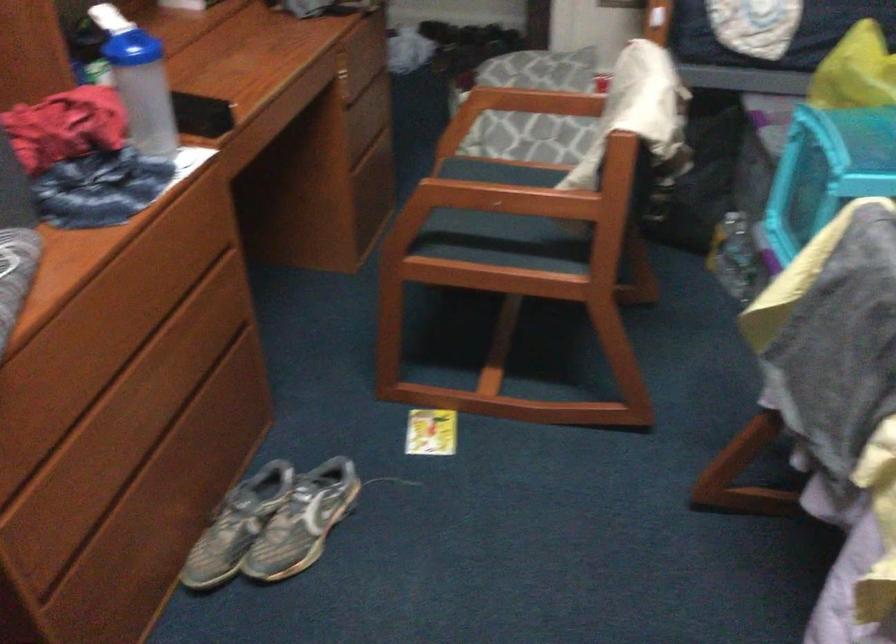
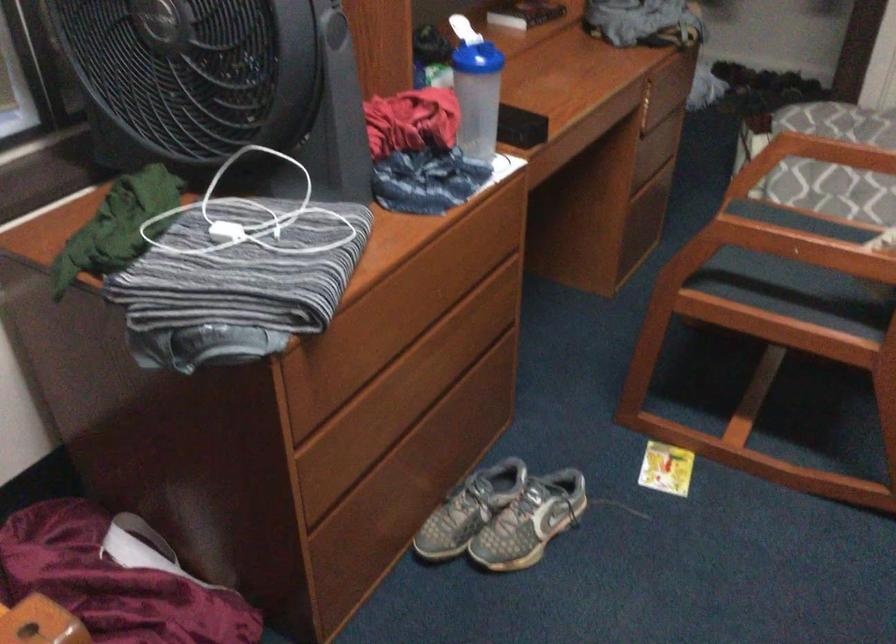
In the second image, find the point that corresponds to the point at 493,200 in the first image.

(790, 245)